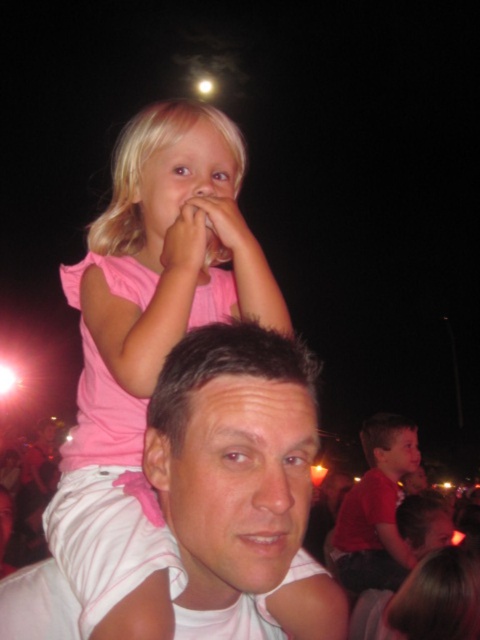
Is pink fabric at upper left positioned in front of smooth skin face at center?

Yes, pink fabric at upper left is in front of smooth skin face at center.

Which is below, pink fabric at upper left or smooth skin face at center?

smooth skin face at center is lower down.

Is point (253, 244) positioned before point (405, 440)?

Yes, it is.

The width and height of the screenshot is (480, 640). I want to click on pink fabric at upper left, so click(x=147, y=328).

Can you confirm if pink fabric at upper left is shorter than blonde hair at center?

No.

Who is lower down, pink fabric at upper left or blonde hair at center?

pink fabric at upper left is lower down.

The image size is (480, 640). I want to click on pink fabric at upper left, so click(x=147, y=328).

Locate an element on the screen. pink fabric at upper left is located at coordinates (147, 328).

Does matte red shirt at center appear on the right side of smooth skin face at center?

No, matte red shirt at center is not to the right of smooth skin face at center.

Which is more to the right, matte red shirt at center or smooth skin face at center?

smooth skin face at center is more to the right.

Between point (365, 556) and point (367, 424), which one is positioned behind?

The point (367, 424) is behind.

Image resolution: width=480 pixels, height=640 pixels. What are the coordinates of `matte red shirt at center` in the screenshot? It's located at (375, 508).